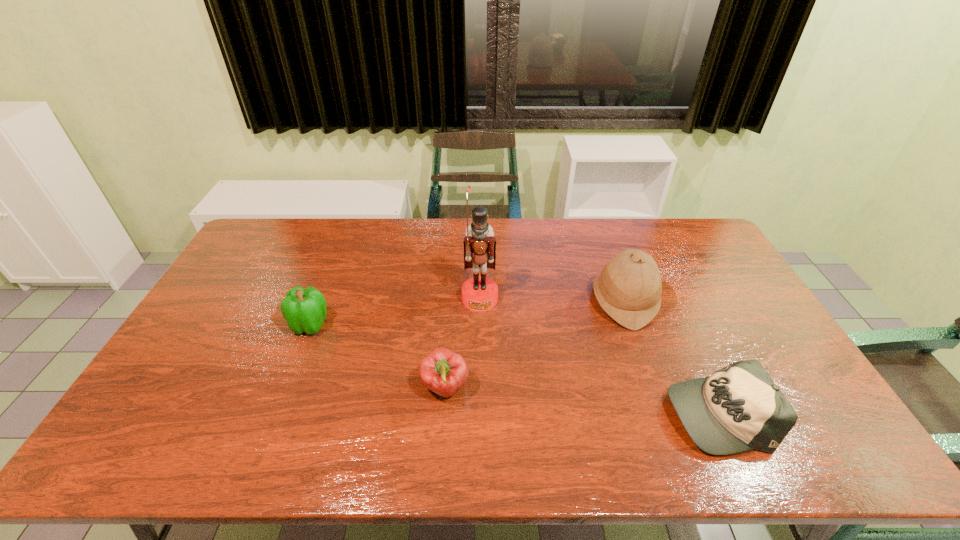
Identify the location of vacant space situated on the front-facing side of the hat. Image resolution: width=960 pixels, height=540 pixels. (519, 301).

Where is `vacant region located 0.270m on the left of the farther bell pepper`? vacant region located 0.270m on the left of the farther bell pepper is located at coordinates (202, 325).

Where is `vacant space located on the right of the shorter bell pepper`? The height and width of the screenshot is (540, 960). vacant space located on the right of the shorter bell pepper is located at coordinates pyautogui.click(x=587, y=388).

Where is `vacant region located 0.050m on the front-facing side of the baseball cap`? vacant region located 0.050m on the front-facing side of the baseball cap is located at coordinates (647, 413).

Locate an element on the screen. vacant region located on the front-facing side of the baseball cap is located at coordinates (564, 413).

You are a GUI agent. You are given a task and a screenshot of the screen. Output one action in this format:
    pyautogui.click(x=<x>, y=<y>)
    Task: Click on the free region located on the front-facing side of the baseball cap
    
    Given the screenshot: What is the action you would take?
    pyautogui.click(x=595, y=413)

Where is `object at the near edge`? object at the near edge is located at coordinates tap(738, 408).

Locate an element on the screen. The height and width of the screenshot is (540, 960). object at the right edge is located at coordinates (738, 408).

Locate an element on the screen. object that is at the near right corner is located at coordinates (738, 408).

The image size is (960, 540). I want to click on free space at the far edge, so [637, 234].